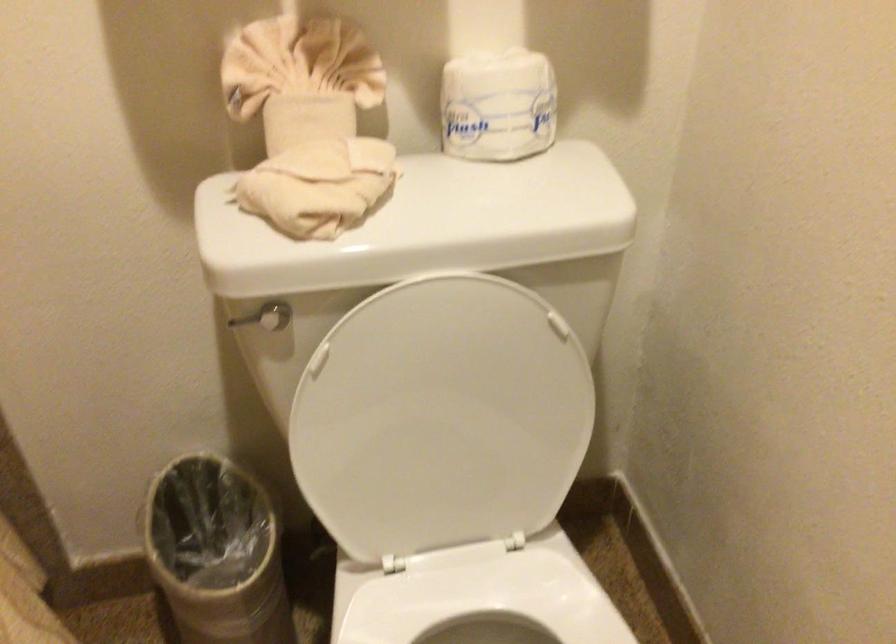
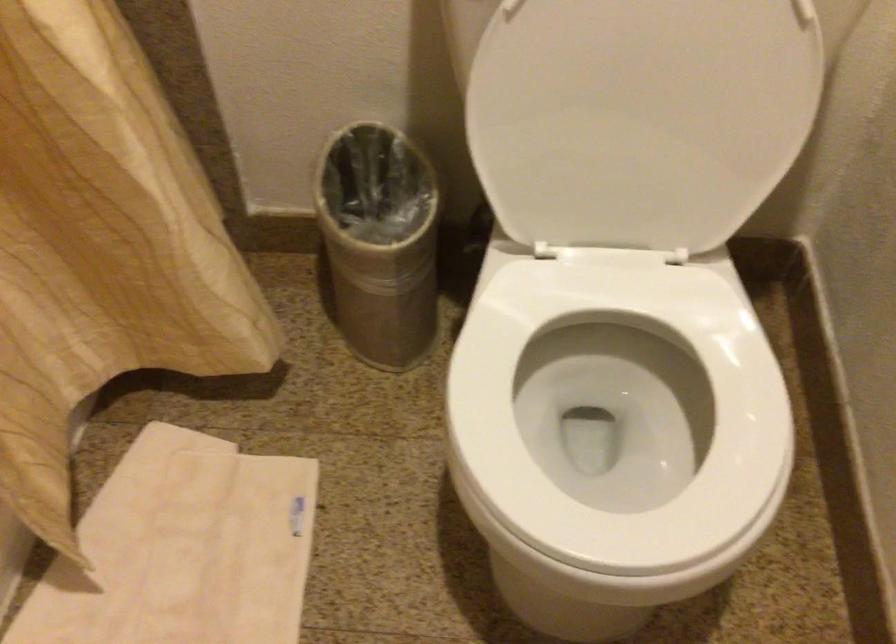
Find the pixel in the second image that matches pixel 454 431 in the first image.

(640, 118)